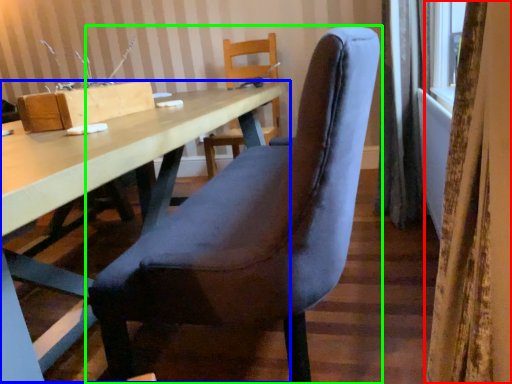
Question: Based on their relative distances, which object is nearer to curtain (highlighted by a red box)? Choose from table (highlighted by a blue box) and chair (highlighted by a green box).

Choices:
 (A) table
 (B) chair

Answer: (B)